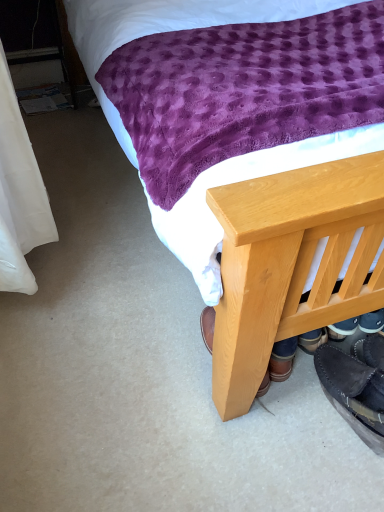
Locate an element on the screen. This screenshot has height=512, width=384. wooden bed frame at lower right is located at coordinates (280, 248).

Consider the image. Which of these two, black suede shoes at lower right, acting as the 2th footwear starting from the left, or wooden bed frame at lower right, is thinner?

black suede shoes at lower right, acting as the 2th footwear starting from the left.

Which of these two, black suede shoes at lower right, which is the 1th footwear in right-to-left order, or wooden bed frame at lower right, stands taller?

With more height is wooden bed frame at lower right.

Is black suede shoes at lower right, acting as the 2th footwear starting from the left, facing towards wooden bed frame at lower right?

Yes, black suede shoes at lower right, acting as the 2th footwear starting from the left, faces towards wooden bed frame at lower right.

Considering the relative positions of black suede shoes at lower right, which is the 1th footwear in right-to-left order, and wooden bed frame at lower right in the image provided, is black suede shoes at lower right, which is the 1th footwear in right-to-left order, to the left or to the right of wooden bed frame at lower right?

Clearly, black suede shoes at lower right, which is the 1th footwear in right-to-left order, is on the left of wooden bed frame at lower right in the image.

Is there a large distance between wooden bed frame at lower right and black suede shoes at lower right, which is the 1th footwear in right-to-left order?

No, wooden bed frame at lower right is not far away from black suede shoes at lower right, which is the 1th footwear in right-to-left order.

From a real-world perspective, is wooden bed frame at lower right under black suede shoes at lower right, acting as the 2th footwear starting from the left?

No, from a real-world perspective, wooden bed frame at lower right is not below black suede shoes at lower right, acting as the 2th footwear starting from the left.

Is wooden bed frame at lower right taller than black suede shoes at lower right, acting as the 2th footwear starting from the left?

Yes, wooden bed frame at lower right is taller than black suede shoes at lower right, acting as the 2th footwear starting from the left.

Looking at their sizes, would you say black suede moccasin at lower right, which appears as the 2th footwear when viewed from the right, is wider or thinner than wooden bed frame at lower right?

Considering their sizes, black suede moccasin at lower right, which appears as the 2th footwear when viewed from the right, looks slimmer than wooden bed frame at lower right.

From the image's perspective, between black suede moccasin at lower right, which appears as the 2th footwear when viewed from the right, and wooden bed frame at lower right, who is located below?

black suede moccasin at lower right, which appears as the 2th footwear when viewed from the right, from the image's perspective.

Locate an element on the screen. The width and height of the screenshot is (384, 512). bed in front of the black suede moccasin at lower right, which appears as the 2th footwear when viewed from the right is located at coordinates (280, 248).

Does black suede moccasin at lower right, which is the 1th footwear in left-to-right order, have a smaller size compared to wooden bed frame at lower right?

Yes.

Is wooden bed frame at lower right smaller than black suede moccasin at lower right, which appears as the 2th footwear when viewed from the right?

Incorrect, wooden bed frame at lower right is not smaller in size than black suede moccasin at lower right, which appears as the 2th footwear when viewed from the right.

What's the angular difference between wooden bed frame at lower right and black suede moccasin at lower right, which appears as the 2th footwear when viewed from the right,'s facing directions?

They differ by 179 degrees in their facing directions.

From the image's perspective, which is above, wooden bed frame at lower right or black suede moccasin at lower right, which is the 1th footwear in left-to-right order?

wooden bed frame at lower right appears higher in the image.

Is point (270, 219) positioned before point (337, 396)?

Yes, it is.

Do you think black suede moccasin at lower right, which appears as the 2th footwear when viewed from the right, is within black suede shoes at lower right, which is the 1th footwear in right-to-left order, or outside of it?

black suede moccasin at lower right, which appears as the 2th footwear when viewed from the right, is not enclosed by black suede shoes at lower right, which is the 1th footwear in right-to-left order.

In terms of size, does black suede moccasin at lower right, which is the 1th footwear in left-to-right order, appear bigger or smaller than black suede shoes at lower right, acting as the 2th footwear starting from the left?

black suede moccasin at lower right, which is the 1th footwear in left-to-right order, is bigger than black suede shoes at lower right, acting as the 2th footwear starting from the left.

Is black suede moccasin at lower right, which appears as the 2th footwear when viewed from the right, shorter than black suede shoes at lower right, which is the 1th footwear in right-to-left order?

No, black suede moccasin at lower right, which appears as the 2th footwear when viewed from the right, is not shorter than black suede shoes at lower right, which is the 1th footwear in right-to-left order.

Is black suede moccasin at lower right, which appears as the 2th footwear when viewed from the right, looking in the opposite direction of black suede shoes at lower right, which is the 1th footwear in right-to-left order?

No.

Is black suede shoes at lower right, acting as the 2th footwear starting from the left, inside or outside of black suede moccasin at lower right, which appears as the 2th footwear when viewed from the right?

black suede shoes at lower right, acting as the 2th footwear starting from the left, is located beyond the bounds of black suede moccasin at lower right, which appears as the 2th footwear when viewed from the right.

From a real-world perspective, is black suede shoes at lower right, acting as the 2th footwear starting from the left, above or below black suede moccasin at lower right, which appears as the 2th footwear when viewed from the right?

Clearly, from a real-world perspective, black suede shoes at lower right, acting as the 2th footwear starting from the left, is above black suede moccasin at lower right, which appears as the 2th footwear when viewed from the right.

Is black suede shoes at lower right, acting as the 2th footwear starting from the left, thinner than black suede moccasin at lower right, which appears as the 2th footwear when viewed from the right?

No.

How many degrees apart are the facing directions of black suede shoes at lower right, which is the 1th footwear in right-to-left order, and black suede moccasin at lower right, which is the 1th footwear in left-to-right order?

There is a 5.78-degree angle between the facing directions of black suede shoes at lower right, which is the 1th footwear in right-to-left order, and black suede moccasin at lower right, which is the 1th footwear in left-to-right order.

Locate an element on the screen. This screenshot has width=384, height=512. the 1st footwear behind the wooden bed frame at lower right, starting your count from the anchor is located at coordinates (370, 351).

Where is `the 1st footwear located beneath the wooden bed frame at lower right (from a real-world perspective)`? the 1st footwear located beneath the wooden bed frame at lower right (from a real-world perspective) is located at coordinates (370, 351).

Based on their spatial positions, is wooden bed frame at lower right or black suede shoes at lower right, which is the 1th footwear in right-to-left order, further from black suede moccasin at lower right, which appears as the 2th footwear when viewed from the right?

Among the two, wooden bed frame at lower right is located further to black suede moccasin at lower right, which appears as the 2th footwear when viewed from the right.

In the scene shown: Based on their spatial positions, is black suede shoes at lower right, which is the 1th footwear in right-to-left order, or black suede moccasin at lower right, which appears as the 2th footwear when viewed from the right, closer to wooden bed frame at lower right?

Among the two, black suede moccasin at lower right, which appears as the 2th footwear when viewed from the right, is located nearer to wooden bed frame at lower right.

Considering their positions, is black suede moccasin at lower right, which appears as the 2th footwear when viewed from the right, positioned closer to wooden bed frame at lower right than black suede shoes at lower right, which is the 1th footwear in right-to-left order?

black suede moccasin at lower right, which appears as the 2th footwear when viewed from the right, lies closer to wooden bed frame at lower right than the other object.

From the picture: Looking at the image, which one is located further to black suede moccasin at lower right, which appears as the 2th footwear when viewed from the right, black suede shoes at lower right, which is the 1th footwear in right-to-left order, or wooden bed frame at lower right?

Among the two, wooden bed frame at lower right is located further to black suede moccasin at lower right, which appears as the 2th footwear when viewed from the right.

From the picture: Estimate the real-world distances between objects in this image. Which object is closer to black suede shoes at lower right, which is the 1th footwear in right-to-left order, black suede moccasin at lower right, which appears as the 2th footwear when viewed from the right, or wooden bed frame at lower right?

black suede moccasin at lower right, which appears as the 2th footwear when viewed from the right, is closer to black suede shoes at lower right, which is the 1th footwear in right-to-left order.

Looking at the image, which one is located further to black suede shoes at lower right, which is the 1th footwear in right-to-left order, wooden bed frame at lower right or black suede moccasin at lower right, which is the 1th footwear in left-to-right order?

wooden bed frame at lower right is positioned further to the anchor black suede shoes at lower right, which is the 1th footwear in right-to-left order.

Identify the location of footwear between wooden bed frame at lower right and black suede moccasin at lower right, which is the 1th footwear in left-to-right order, in the vertical direction. (370, 351).